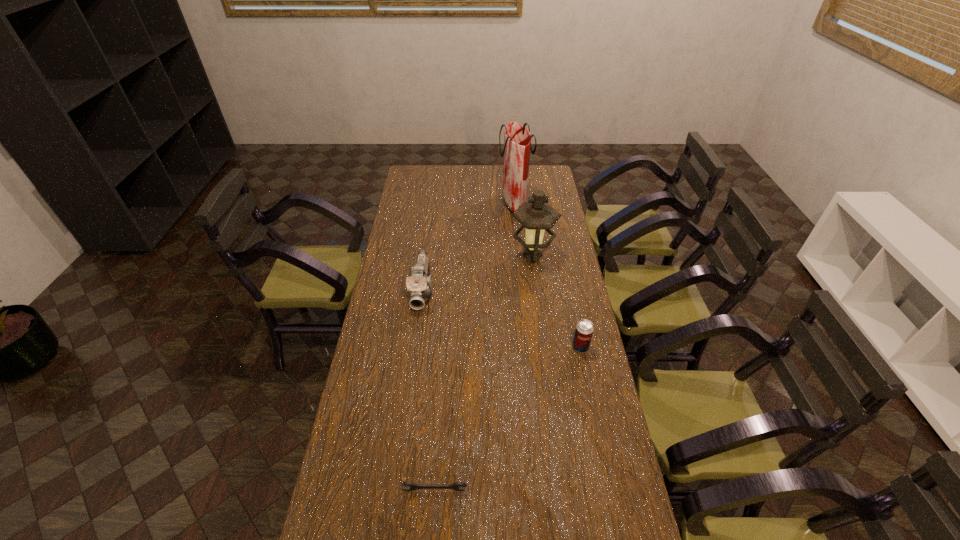
Find the location of a particular element. This screenshot has width=960, height=540. vacant space in between the tallest object and the oil lamp is located at coordinates (523, 230).

Locate an element on the screen. Image resolution: width=960 pixels, height=540 pixels. the fourth closest object to the grocery bag is located at coordinates (456, 486).

Find the location of a particular element. The width and height of the screenshot is (960, 540). object that is the closest to the camcorder is located at coordinates (536, 215).

This screenshot has width=960, height=540. In order to click on blank area in the image that satisfies the following two spatial constraints: 1. on the front side of the second shortest object; 2. on the right side of the tallest object in this screenshot , I will do `click(528, 347)`.

Where is `vacant area that satisfies the following two spatial constraints: 1. on the front side of the farthest object; 2. on the right side of the second nearest object`? The image size is (960, 540). vacant area that satisfies the following two spatial constraints: 1. on the front side of the farthest object; 2. on the right side of the second nearest object is located at coordinates (528, 347).

In order to click on free spot that satisfies the following two spatial constraints: 1. on the front side of the oil lamp; 2. on the left side of the farthest object in this screenshot , I will do `click(519, 256)`.